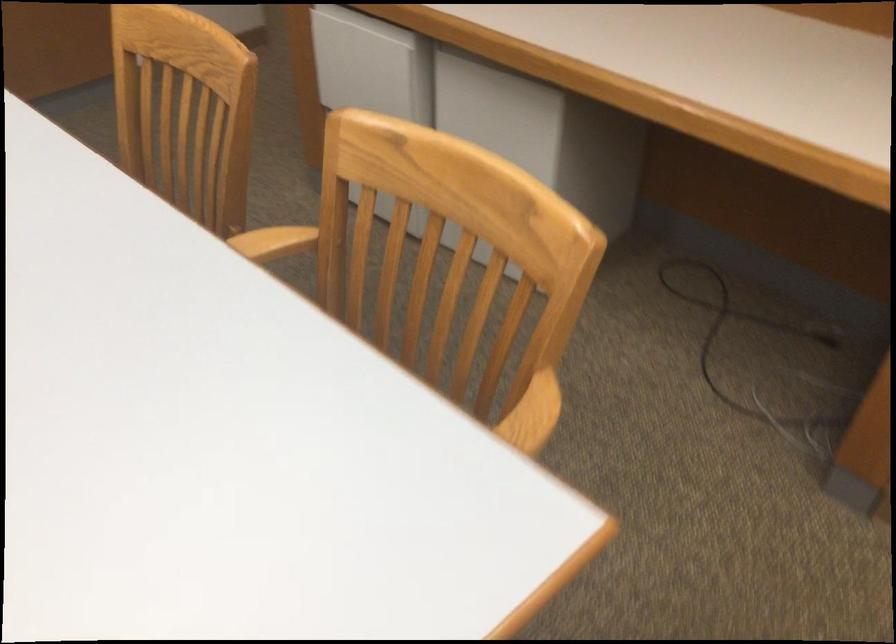
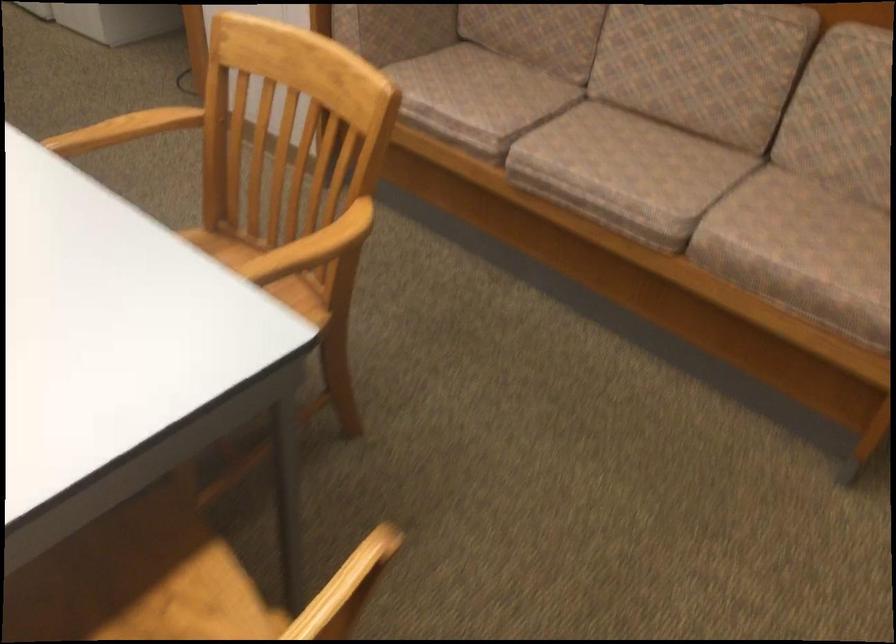
What movement of the cameraman would produce the second image?

The movement direction of the cameraman is right, backward.